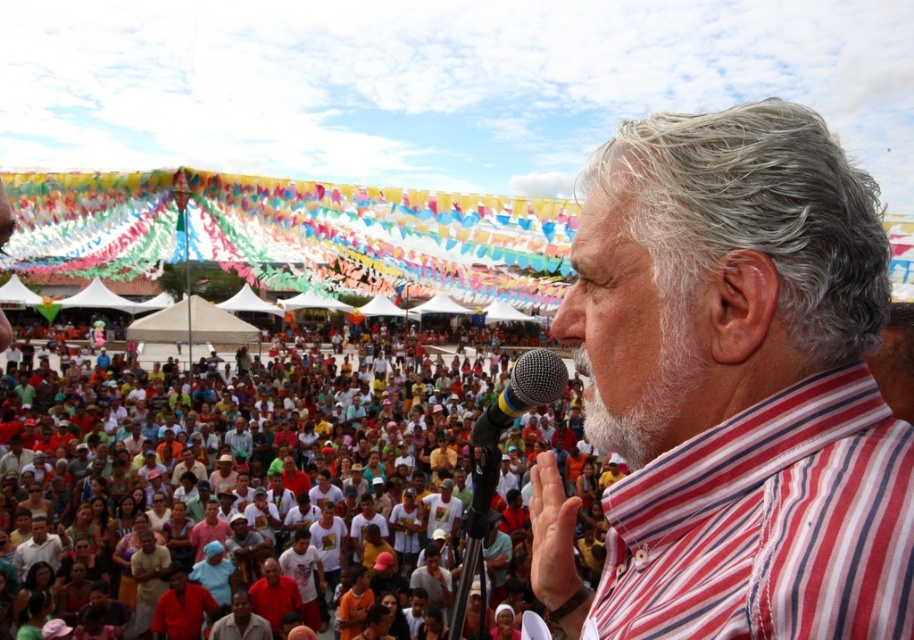
Question: Which point appears closest to the camera in this image?

Choices:
 (A) (756, 449)
 (B) (538, 392)

Answer: (A)

Question: Which point is closer to the camera?

Choices:
 (A) (856, 497)
 (B) (112, 452)

Answer: (A)

Question: Does striped cotton shirt at center have a lesser width compared to multicolored fabric crowd at center?

Choices:
 (A) yes
 (B) no

Answer: (A)

Question: Which point is farther to the camera?

Choices:
 (A) (487, 444)
 (B) (863, 376)

Answer: (A)

Question: Does multicolored fabric crowd at center come in front of multicolored plastic microphone at center?

Choices:
 (A) yes
 (B) no

Answer: (B)

Question: Can you confirm if multicolored fabric crowd at center is positioned below red striped shirt at center?

Choices:
 (A) yes
 (B) no

Answer: (B)